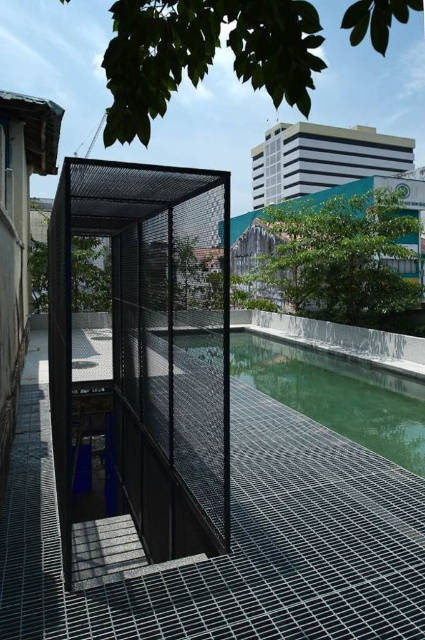
Which is more to the left, black mesh cage at center or green glass water at center?

From the viewer's perspective, black mesh cage at center appears more on the left side.

Based on the photo, is black mesh cage at center to the right of green glass water at center from the viewer's perspective?

Incorrect, black mesh cage at center is not on the right side of green glass water at center.

Where is `black mesh cage at center`? black mesh cage at center is located at coordinates (141, 358).

Image resolution: width=425 pixels, height=640 pixels. What are the coordinates of `black mesh cage at center` in the screenshot? It's located at (141, 358).